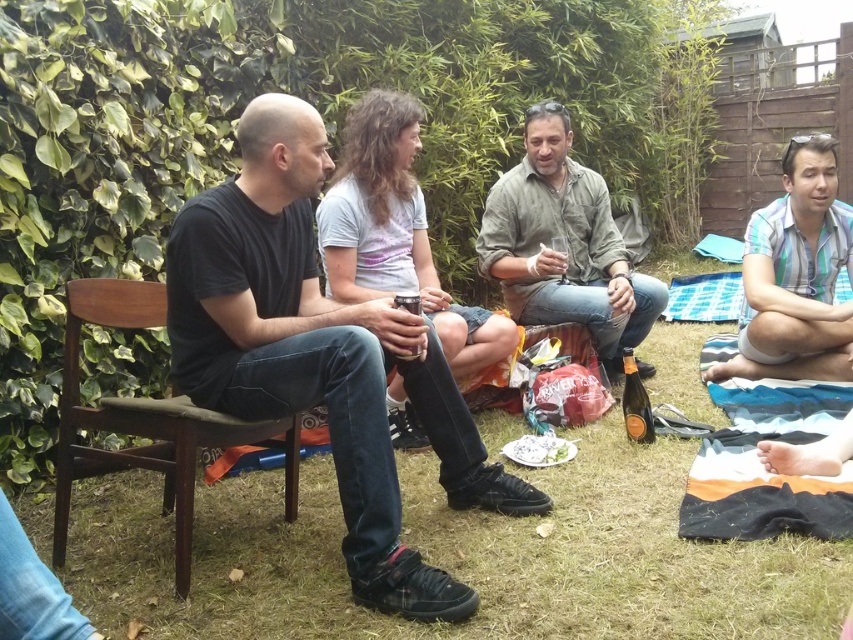
Is rough brown shirt at center positioned at the back of brown wooden chair at left?

Yes.

Who is lower down, rough brown shirt at center or brown wooden chair at left?

Positioned lower is brown wooden chair at left.

Who is more forward, (631, 305) or (125, 298)?

Point (125, 298)

The image size is (853, 640). Find the location of `rough brown shirt at center`. rough brown shirt at center is located at coordinates (563, 244).

Is rough brown shirt at center taller than blue striped shirt at lower right?

Indeed, rough brown shirt at center has a greater height compared to blue striped shirt at lower right.

Who is more forward, (583, 220) or (843, 232)?

Point (843, 232) is more forward.

Where is `rough brown shirt at center`? The width and height of the screenshot is (853, 640). rough brown shirt at center is located at coordinates (563, 244).

Who is more distant from viewer, (184, 468) or (692, 474)?

The point (692, 474) is more distant.

Which of these two, brown wooden chair at left or striped cotton towel at lower right, stands shorter?

striped cotton towel at lower right is shorter.

Between point (115, 298) and point (813, 481), which one is positioned behind?

The point (813, 481) is more distant.

Image resolution: width=853 pixels, height=640 pixels. What are the coordinates of `brown wooden chair at left` in the screenshot? It's located at (148, 420).